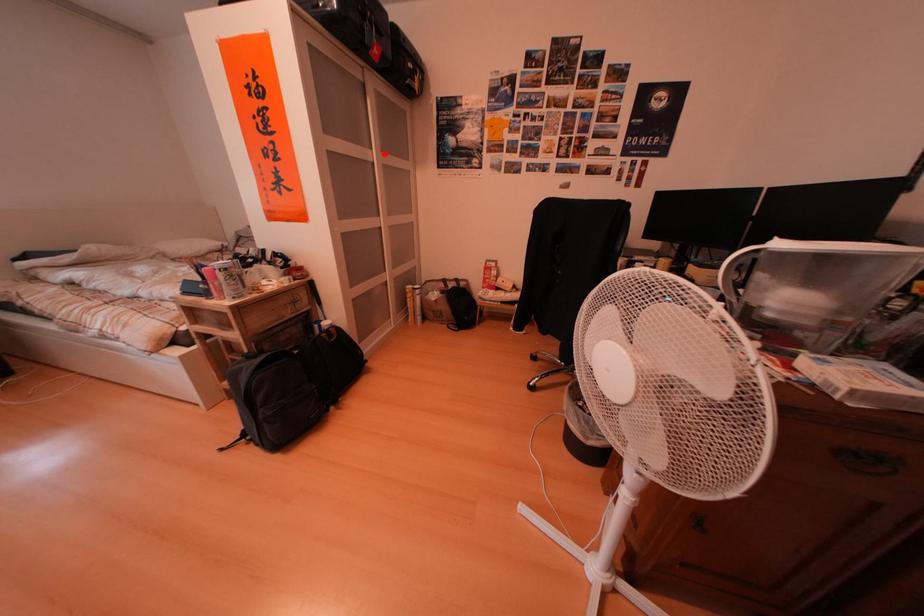
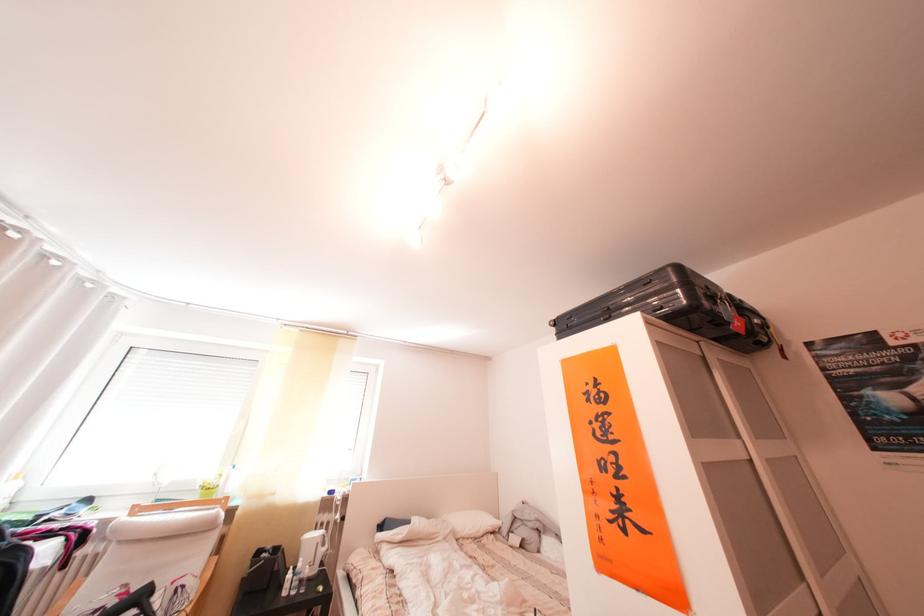
The point at the highlighted location is marked in the first image. Where is the corresponding point in the second image?

(751, 442)